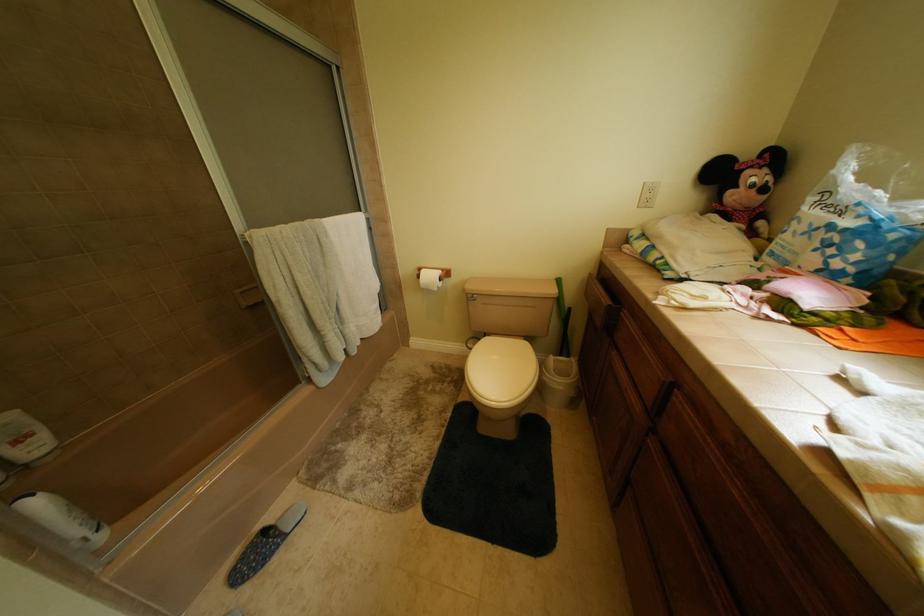
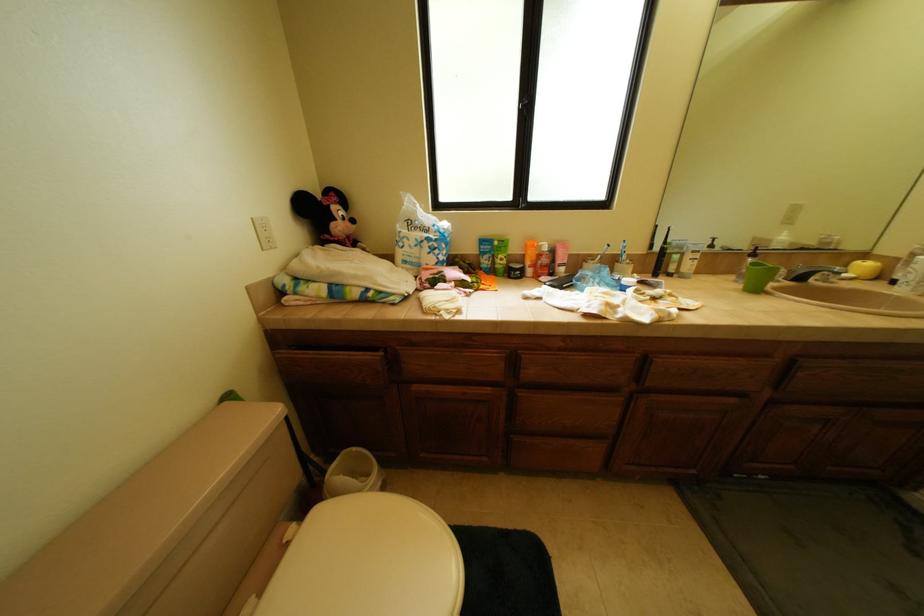
First-person continuous shooting, in which direction is the camera rotating?

The camera's rotation is toward right-down.